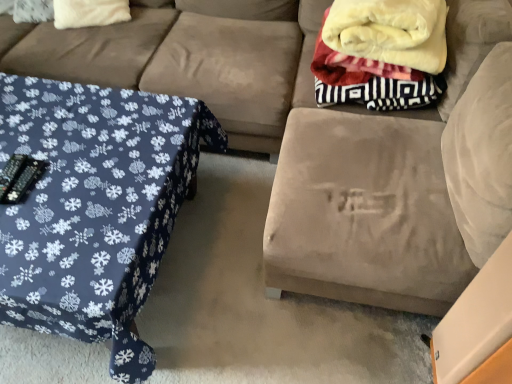
Question: From the image's perspective, is suede couch at upper left on top of white fluffy pillow at upper left?

Choices:
 (A) no
 (B) yes

Answer: (A)

Question: Does suede couch at upper left have a lesser height compared to white fluffy pillow at upper left?

Choices:
 (A) no
 (B) yes

Answer: (A)

Question: Is suede couch at upper left directly adjacent to white fluffy pillow at upper left?

Choices:
 (A) no
 (B) yes

Answer: (A)

Question: Is suede couch at upper left smaller than white fluffy pillow at upper left?

Choices:
 (A) no
 (B) yes

Answer: (A)

Question: Is suede couch at upper left in front of white fluffy pillow at upper left?

Choices:
 (A) yes
 (B) no

Answer: (A)

Question: From their relative heights in the image, would you say soft fleece blanket at upper right is taller or shorter than blue fabric table at left?

Choices:
 (A) tall
 (B) short

Answer: (B)

Question: Based on their positions, is soft fleece blanket at upper right located to the left or right of blue fabric table at left?

Choices:
 (A) right
 (B) left

Answer: (A)

Question: Relative to blue fabric table at left, is soft fleece blanket at upper right in front or behind?

Choices:
 (A) front
 (B) behind

Answer: (B)

Question: From the image's perspective, is soft fleece blanket at upper right positioned above or below blue fabric table at left?

Choices:
 (A) above
 (B) below

Answer: (A)

Question: From the image's perspective, is white fluffy pillow at upper left located above or below soft fleece blanket at upper right?

Choices:
 (A) above
 (B) below

Answer: (A)

Question: From a real-world perspective, is white fluffy pillow at upper left positioned above or below soft fleece blanket at upper right?

Choices:
 (A) below
 (B) above

Answer: (A)

Question: Choose the correct answer: Is white fluffy pillow at upper left inside soft fleece blanket at upper right or outside it?

Choices:
 (A) outside
 (B) inside

Answer: (A)

Question: In the image, is white fluffy pillow at upper left on the left side or the right side of soft fleece blanket at upper right?

Choices:
 (A) left
 (B) right

Answer: (A)

Question: In the image, is blue fabric table at left on the left side or the right side of white fluffy pillow at upper left?

Choices:
 (A) right
 (B) left

Answer: (A)

Question: From the image's perspective, relative to white fluffy pillow at upper left, is blue fabric table at left above or below?

Choices:
 (A) above
 (B) below

Answer: (B)